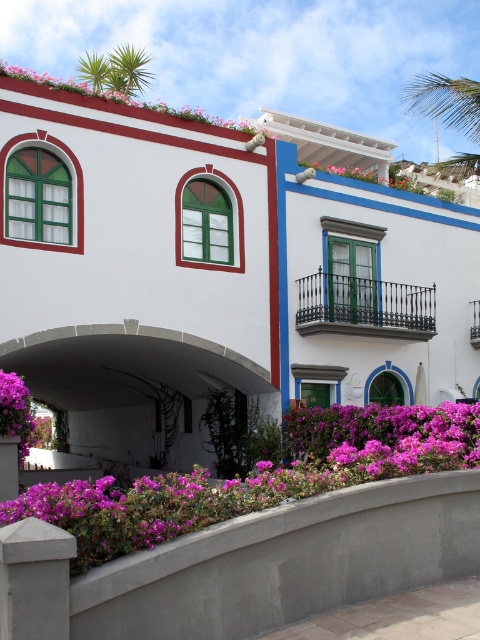
Question: Does purple matte flowers at lower left appear over white concrete archway at center?

Choices:
 (A) yes
 (B) no

Answer: (A)

Question: Which point is closer to the camera?

Choices:
 (A) purple matte flower at lower left
 (B) purple matte flowers at center

Answer: (B)

Question: Observing the image, what is the correct spatial positioning of purple matte flowers at lower left in reference to white concrete archway at center?

Choices:
 (A) right
 (B) left

Answer: (A)

Question: Among these points, which one is farthest from the camera?

Choices:
 (A) (27, 348)
 (B) (10, 403)

Answer: (A)

Question: Which of the following is the closest to the observer?

Choices:
 (A) (245, 128)
 (B) (434, 408)

Answer: (B)

Question: Does purple matte flowers at center appear over pink matte flowers at upper left?

Choices:
 (A) no
 (B) yes

Answer: (A)